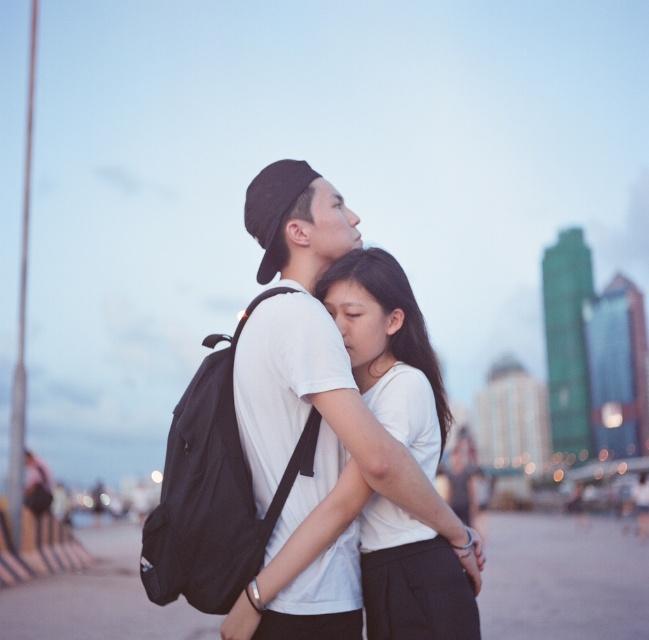
Question: Does white matte shirt at center have a greater width compared to black matte backpack at center?

Choices:
 (A) no
 (B) yes

Answer: (B)

Question: Which point is farther from the camera taking this photo?

Choices:
 (A) (286, 566)
 (B) (223, 552)

Answer: (A)

Question: Can you confirm if white matte shirt at center is positioned below black matte backpack at center?

Choices:
 (A) yes
 (B) no

Answer: (B)

Question: Is white matte shirt at center smaller than black matte backpack at center?

Choices:
 (A) yes
 (B) no

Answer: (B)

Question: Which point is farther to the camera?

Choices:
 (A) (402, 276)
 (B) (214, 492)

Answer: (A)